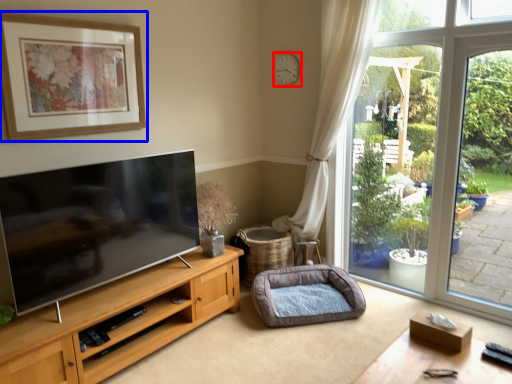
Question: Which point is closer to the camera, clock (highlighted by a red box) or picture frame (highlighted by a blue box)?

Choices:
 (A) clock
 (B) picture frame

Answer: (B)